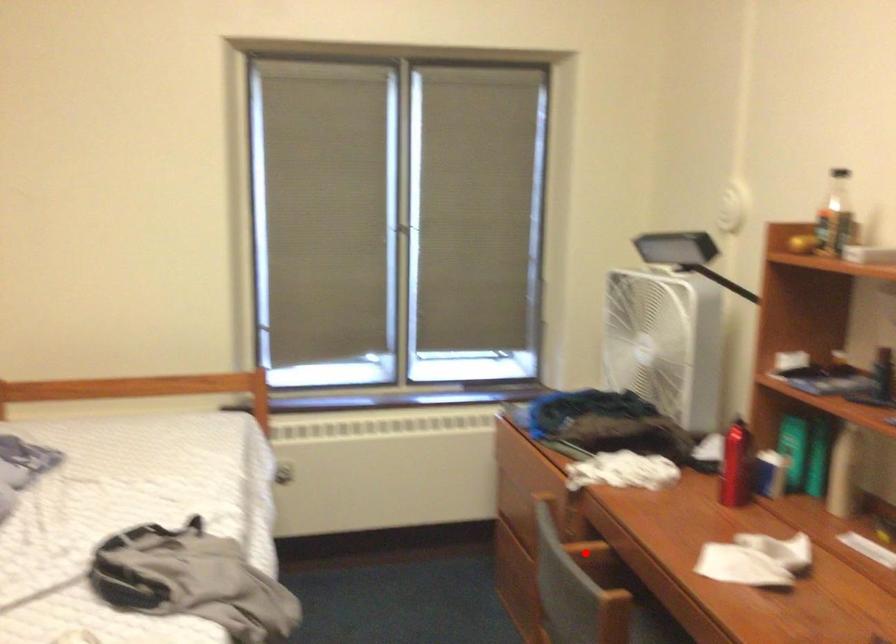
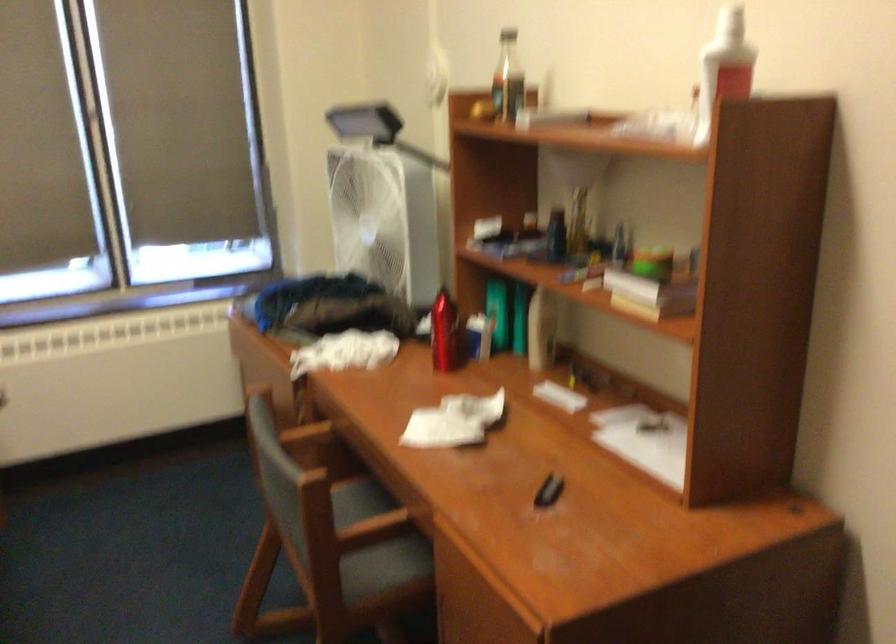
The point at the highlighted location is marked in the first image. Where is the corresponding point in the second image?

(306, 435)